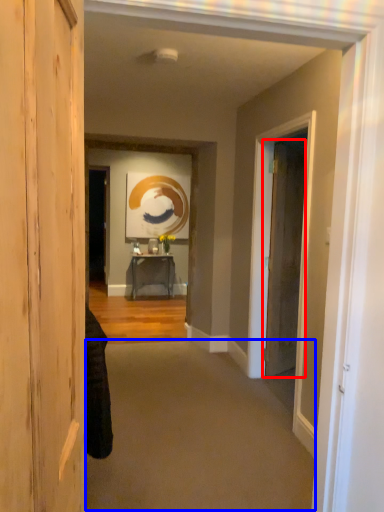
Question: Which of the following is the closest to the observer, door (highlighted by a red box) or plain (highlighted by a blue box)?

Choices:
 (A) door
 (B) plain

Answer: (B)